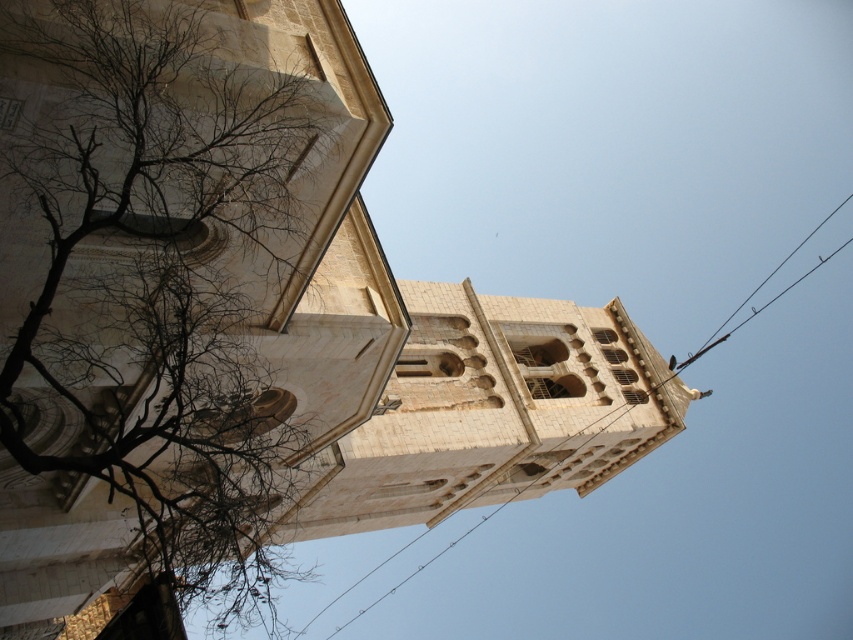
You are standing in front of the historic stone building and notice two black wires in the upper part of the image. Which one is positioned closer to you, the black wire at upper center or the black wire at upper right?

The black wire at upper center is closer to the viewer than the black wire at upper right.

You are a photographer wanting to capture the historic stone building. You notice two black wires in the frame. Which black wire is positioned more to the left between the black wire at upper center and the black wire at upper right?

The black wire at upper center is positioned more to the left compared to the black wire at upper right.